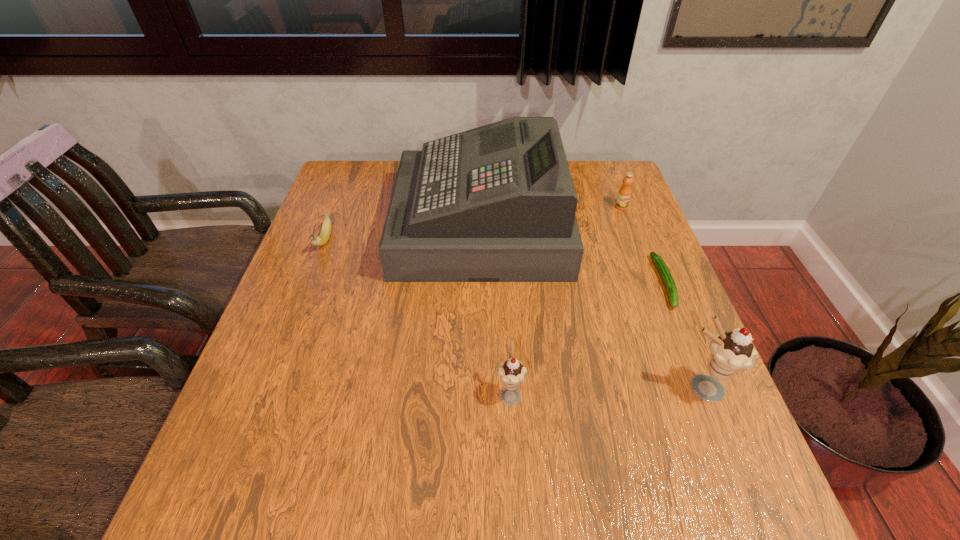
Find the location of a particular element. the shorter icecream is located at coordinates (512, 372).

Identify the location of the left icecream. The width and height of the screenshot is (960, 540). (512, 372).

Find the location of `the right icecream`. the right icecream is located at coordinates (730, 352).

The image size is (960, 540). What are the coordinates of `the second tallest object` in the screenshot? It's located at (730, 352).

Locate an element on the screen. Image resolution: width=960 pixels, height=540 pixels. orange juice is located at coordinates (624, 194).

This screenshot has height=540, width=960. Find the location of `the tallest object`. the tallest object is located at coordinates (497, 203).

Find the location of a particular element. The width and height of the screenshot is (960, 540). the leftmost object is located at coordinates (325, 233).

Find the location of `the fifth tallest object`. the fifth tallest object is located at coordinates (325, 233).

The width and height of the screenshot is (960, 540). I want to click on zucchini, so click(669, 283).

In order to click on free location located on the left of the left icecream in this screenshot , I will do `click(336, 393)`.